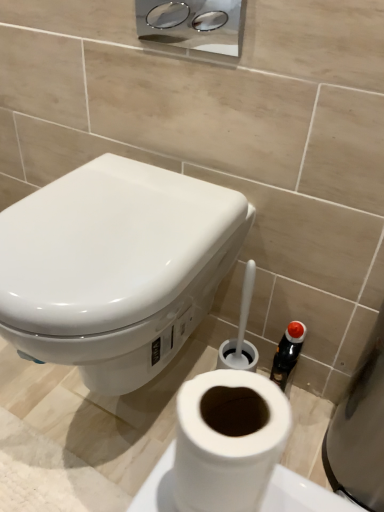
Question: Is chrome metallic dispenser at upper center inside the boundaries of white matte toilet paper at lower center, or outside?

Choices:
 (A) inside
 (B) outside

Answer: (B)

Question: From their relative heights in the image, would you say chrome metallic dispenser at upper center is taller or shorter than white matte toilet paper at lower center?

Choices:
 (A) short
 (B) tall

Answer: (B)

Question: Which object is positioned closest to the chrome metallic dispenser at upper center?

Choices:
 (A) white glossy toilet at upper left
 (B) white matte toilet paper at lower center

Answer: (A)

Question: Estimate the real-world distances between objects in this image. Which object is farther from the white glossy toilet at upper left?

Choices:
 (A) chrome metallic dispenser at upper center
 (B) white matte toilet paper at lower center

Answer: (A)